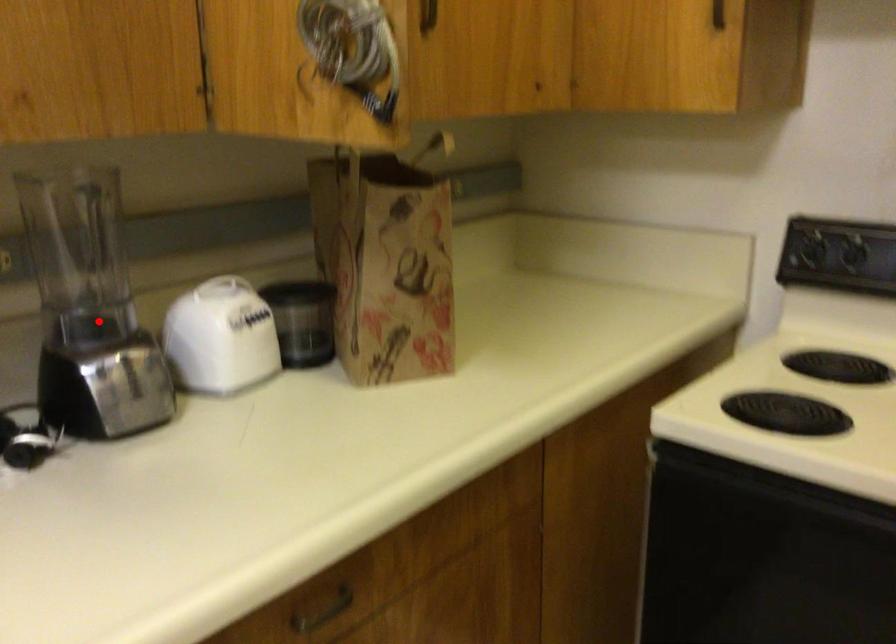
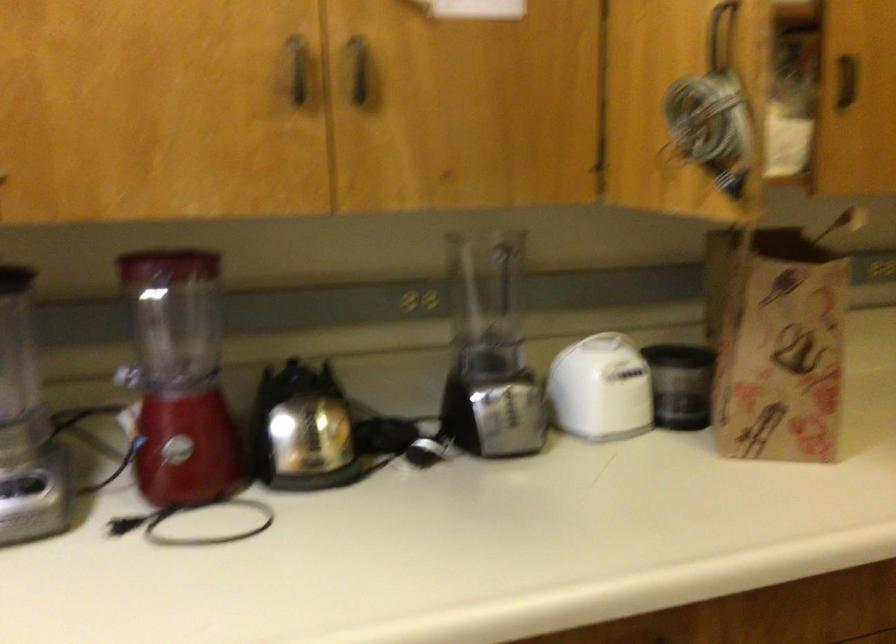
Question: I am providing you with two images of the same scene from different viewpoints. Given a red point in image1, look at the same physical point in image2. Is it:

Choices:
 (A) Closer to the viewpoint
 (B) Farther from the viewpoint

Answer: (B)